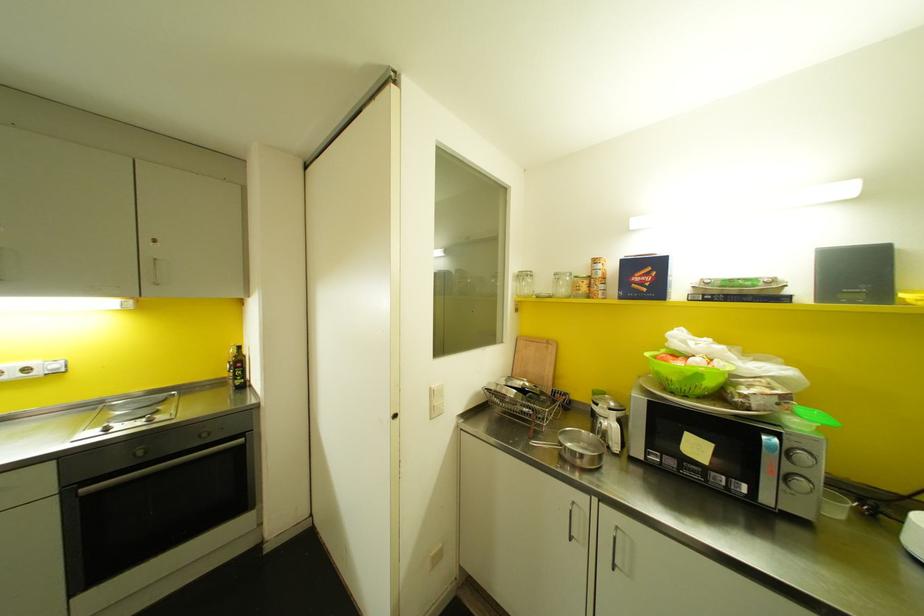
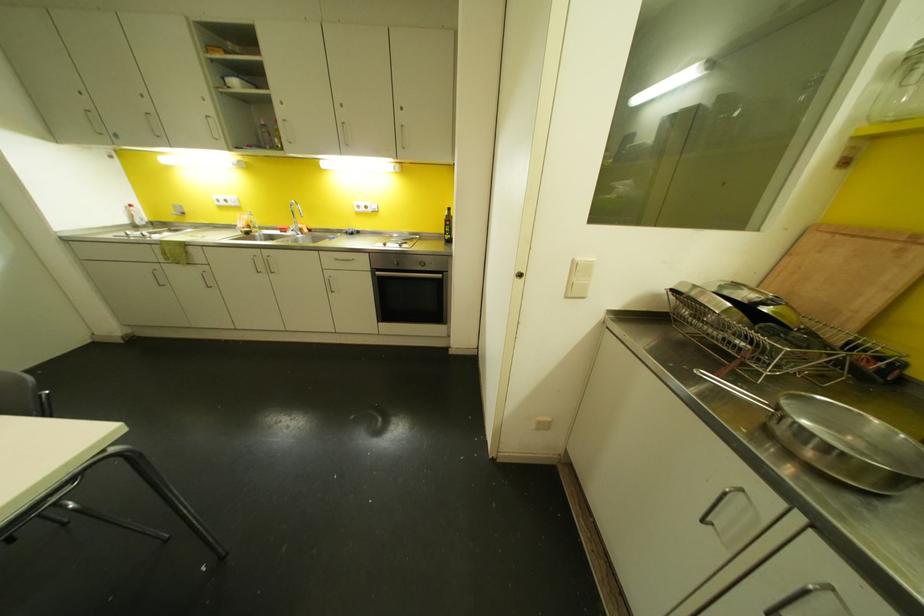
First-person continuous shooting, in which direction is the camera rotating?

The camera's rotation is toward left-down.